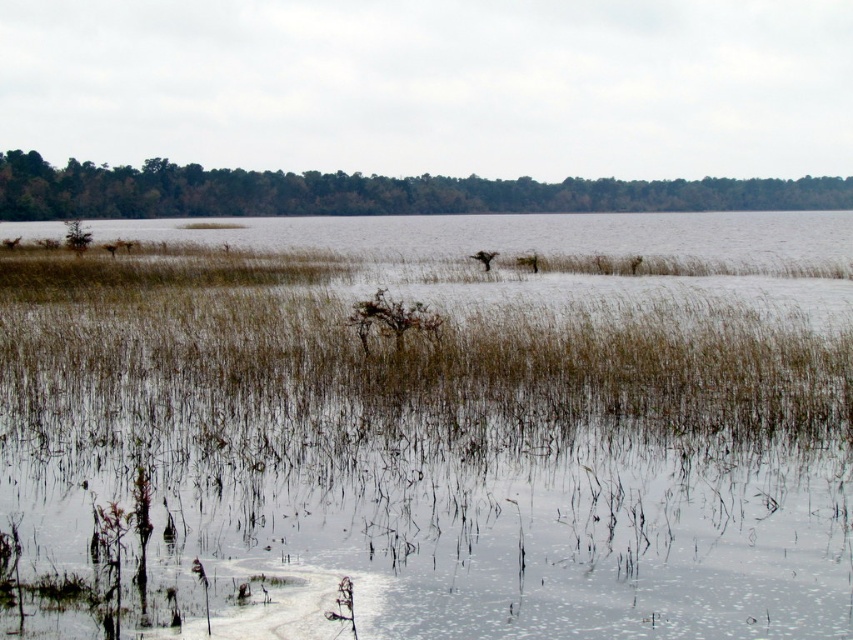
You are standing in the wetland scene and want to reach the point marked at coordinates point (114, 566). If your walking speed is 1.2 meters per second, how long will it take you to reach that point?

The distance between you and point (114, 566) is 7.92 meters. At a speed of 1.2 meters per second, it will take approximately 6.6 seconds to reach the point.

You are a bird looking for a nesting spot. You see the brown dry grass at center and the green matte trees at upper center. Which location offers a higher vantage point for nesting?

The green matte trees at upper center are taller than the brown dry grass at center, so they provide a higher vantage point for nesting.

You are standing at the edge of the wetland and want to walk towards the point with coordinates point (397, 515) and point (206, 214). Which point will you reach first?

You will reach point (397, 515) first because it is closer to you than point (206, 214).